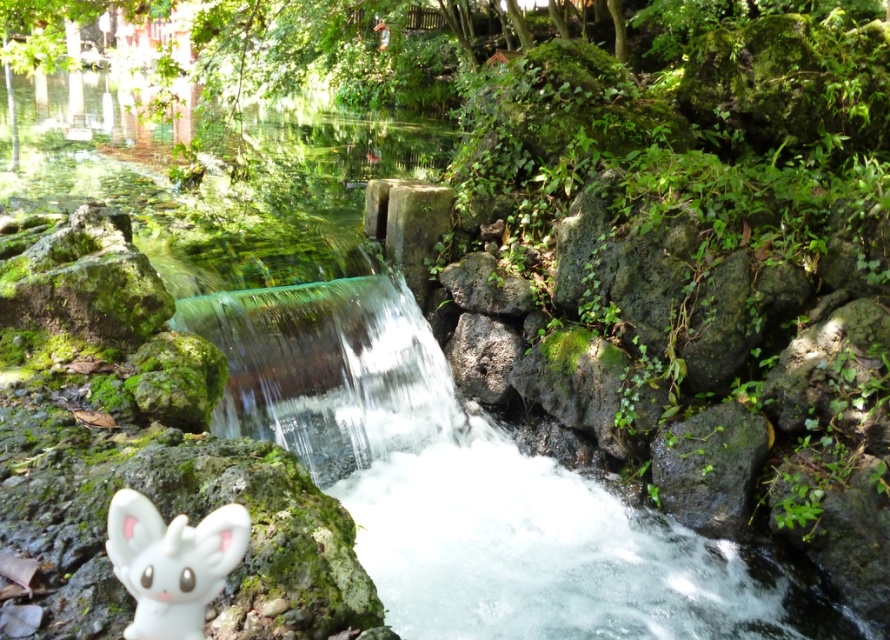
Which is behind, point (166, 628) or point (689, 429)?

The point (689, 429) is more distant.

Is white matte plush at lower left positioned in front of green mossy rock at center-right?

Yes, white matte plush at lower left is closer to the viewer.

The width and height of the screenshot is (890, 640). What do you see at coordinates (172, 563) in the screenshot? I see `white matte plush at lower left` at bounding box center [172, 563].

Locate an element on the screen. white matte plush at lower left is located at coordinates (172, 563).